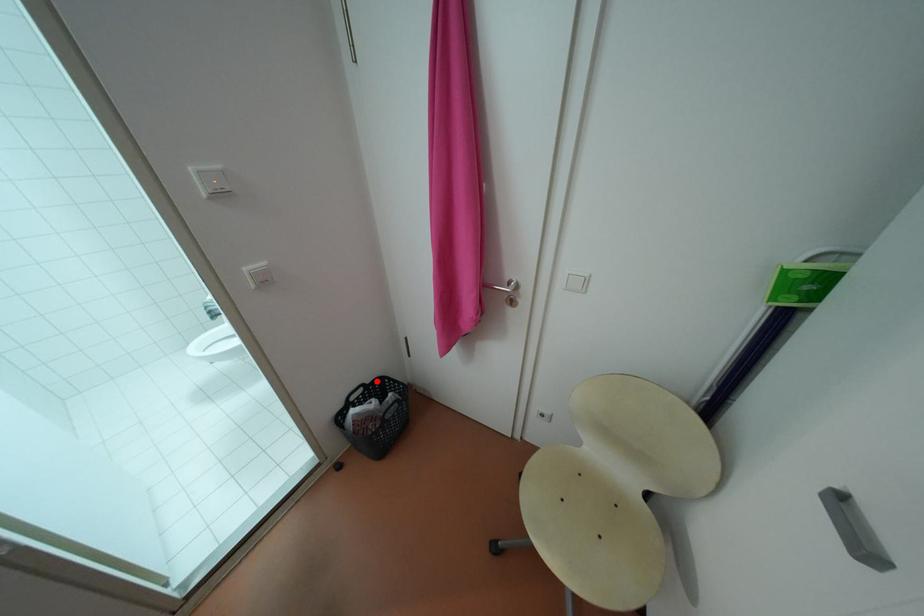
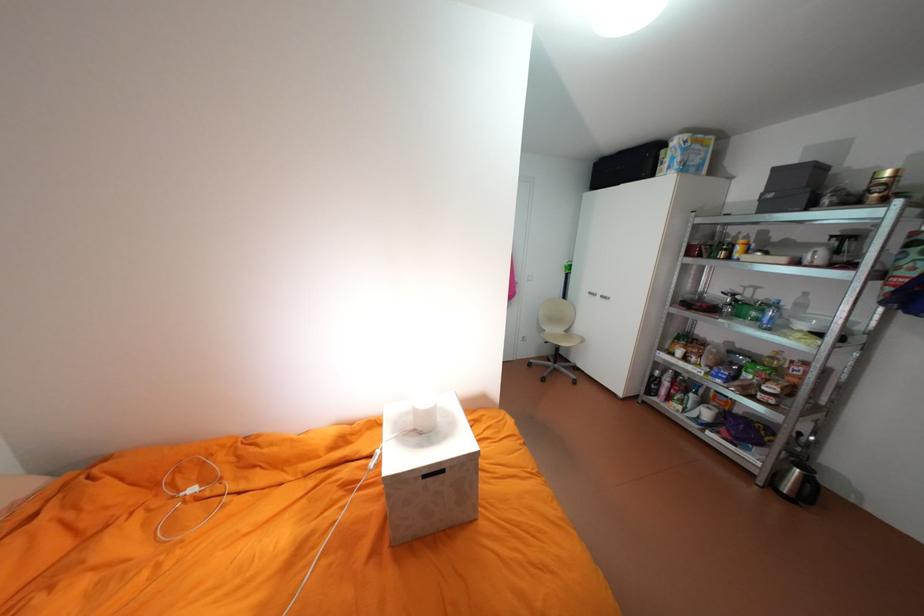
Question: I am providing you with two images of the same scene from different viewpoints. A red point is marked on the first image. Is the red point's position out of view in image 2?

Choices:
 (A) Yes
 (B) No

Answer: (A)